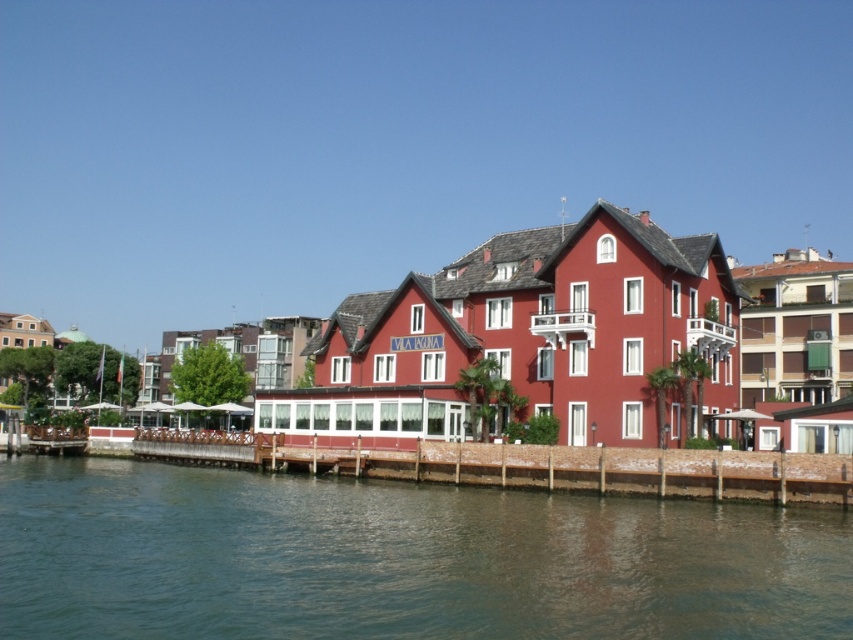
You are a delivery person trying to park your electric scooter. You see the greenish water at lower center and the brown wooden dock at lower center. Which area is larger and more suitable for parking your scooter?

The greenish water at lower center is bigger than the brown wooden dock at lower center, so it is more suitable for parking your scooter.

You are standing at the point labeled point (496, 468) and want to walk to the entrance of the building. There is a path that goes through point (608, 576). Is this path in the correct direction towards the building?

Yes, the path through point (608, 576) is in the correct direction because point (608, 576) is in front of point (496, 468), meaning it leads towards the building.

Based on the photo, you are standing at the point labeled point [438,429] and want to walk towards the entrance of the building. Which direction should you move relative to the point labeled point [592,550]?

You should move towards the point labeled point [592,550] because it is in front of point [438,429], indicating that direction leads toward the building entrance.